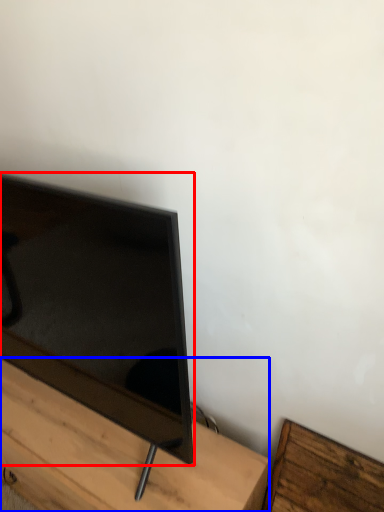
Question: Which point is closer to the camera, television (highlighted by a red box) or furniture (highlighted by a blue box)?

Choices:
 (A) television
 (B) furniture

Answer: (A)